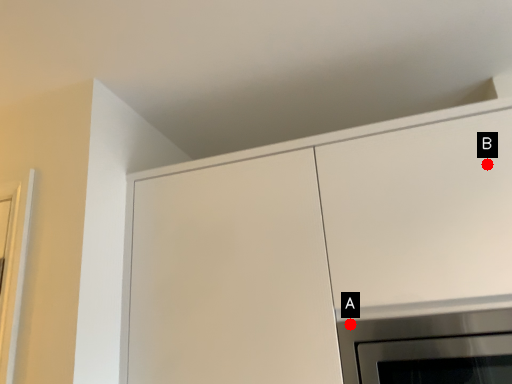
Question: Two points are circled on the image, labeled by A and B beside each circle. Which point is further to the camera?

Choices:
 (A) A is further
 (B) B is further

Answer: (B)